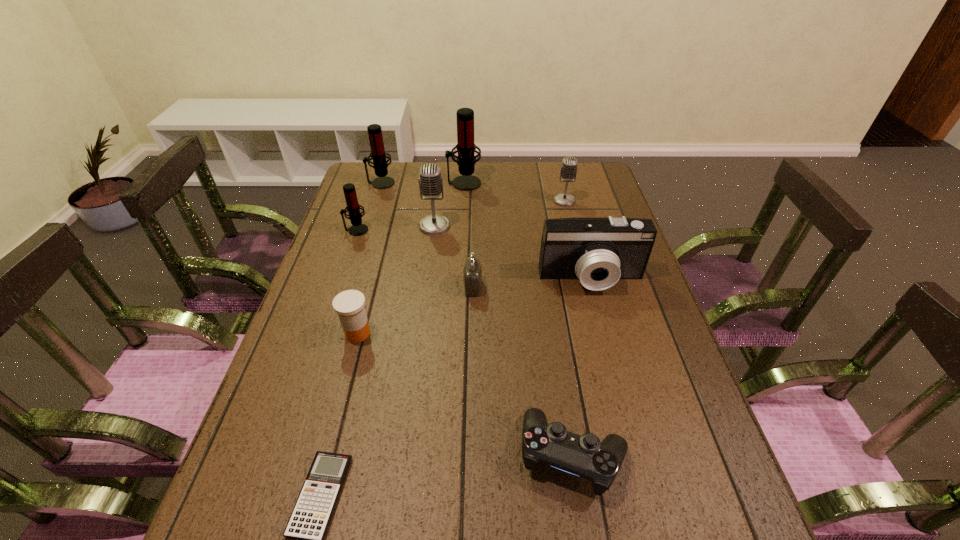
Locate an element on the screen. The image size is (960, 540). the tallest object is located at coordinates (466, 161).

Where is `the tallest microphone`? The width and height of the screenshot is (960, 540). the tallest microphone is located at coordinates (466, 161).

Locate an element on the screen. This screenshot has height=540, width=960. the left gray microphone is located at coordinates 430,181.

Where is `the bigger gray microphone`? the bigger gray microphone is located at coordinates (430, 181).

What are the coordinates of `the second smallest red microphone` in the screenshot? It's located at (378, 154).

Where is `camcorder`? camcorder is located at coordinates (599, 251).

I want to click on the smaller gray microphone, so click(x=568, y=171).

At what (x,y) coordinates should I click in order to perform the action: click on the third nearest microphone. Please return your answer as a coordinate pair (x, y). Looking at the image, I should click on [568, 171].

Find the location of a particular element. The height and width of the screenshot is (540, 960). the smallest red microphone is located at coordinates (353, 208).

Locate an element on the screen. This screenshot has width=960, height=540. padlock is located at coordinates (472, 271).